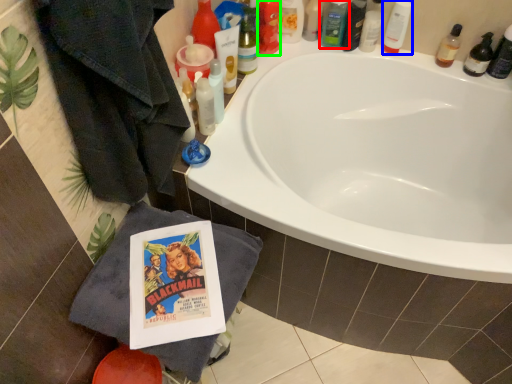
Question: Which object is the farthest from toiletry (highlighted by a red box)? Choose among these: toiletry (highlighted by a blue box) or toiletry (highlighted by a green box).

Choices:
 (A) toiletry
 (B) toiletry

Answer: (B)